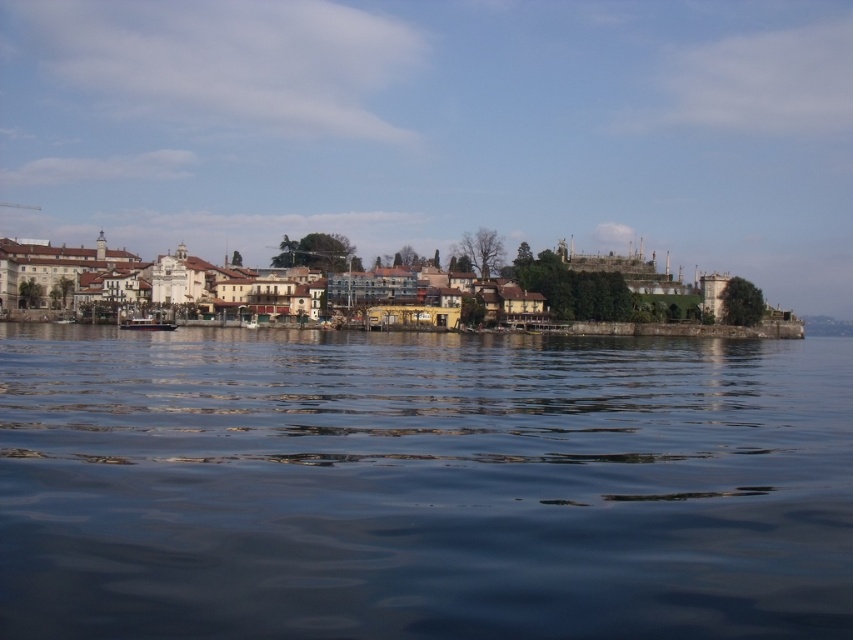
Question: Is dark blue water at center to the right of metallic polished boat at center from the viewer's perspective?

Choices:
 (A) no
 (B) yes

Answer: (B)

Question: Which is nearer to the metallic polished boat at center?

Choices:
 (A) multicolored wooden houses at center
 (B) dark blue water at center

Answer: (A)

Question: Which is nearer to the metallic polished boat at center?

Choices:
 (A) dark blue water at center
 (B) multicolored wooden houses at center

Answer: (B)

Question: Considering the real-world distances, which object is farthest from the multicolored wooden houses at center?

Choices:
 (A) metallic polished boat at center
 (B) dark blue water at center

Answer: (B)

Question: Is multicolored wooden houses at center smaller than metallic polished boat at center?

Choices:
 (A) no
 (B) yes

Answer: (A)

Question: Does dark blue water at center come behind multicolored wooden houses at center?

Choices:
 (A) yes
 (B) no

Answer: (B)